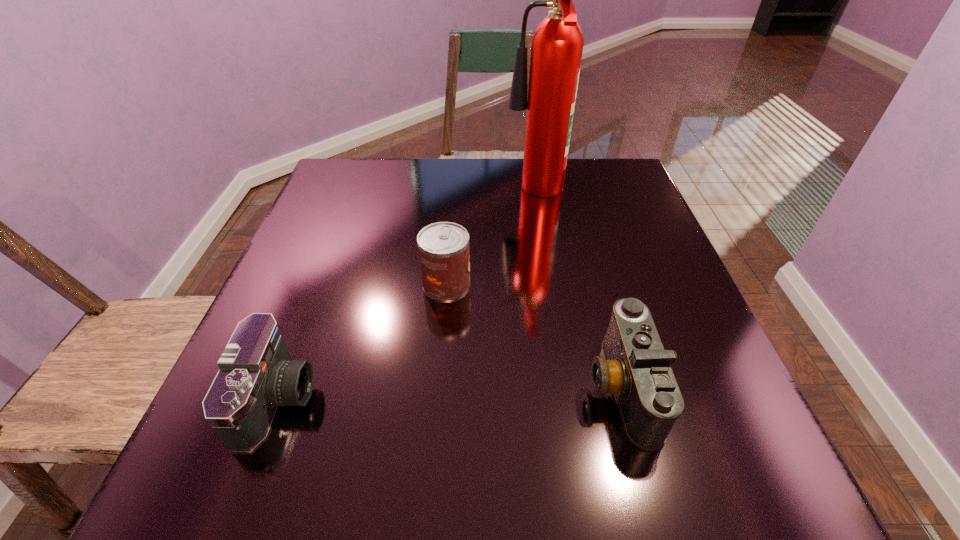
Identify the location of vacant area located on the lens of the right camera. Image resolution: width=960 pixels, height=540 pixels. (362, 386).

Image resolution: width=960 pixels, height=540 pixels. Find the location of `free spot located on the lens of the right camera`. free spot located on the lens of the right camera is located at coordinates (545, 386).

Image resolution: width=960 pixels, height=540 pixels. What are the coordinates of `vacant space located on the lens of the right camera` in the screenshot? It's located at (491, 386).

At what (x,y) coordinates should I click in order to perform the action: click on vacant space located on the front-facing side of the leftmost object. Please return your answer as a coordinate pair (x, y). Looking at the image, I should click on (557, 399).

At what (x,y) coordinates should I click in order to perform the action: click on object present at the far edge. Please return your answer as a coordinate pair (x, y). Looking at the image, I should click on (557, 44).

At what (x,y) coordinates should I click in order to perform the action: click on object situated at the left edge. Please return your answer as a coordinate pair (x, y). The width and height of the screenshot is (960, 540). Looking at the image, I should click on (256, 374).

Identify the location of object that is at the right edge. The width and height of the screenshot is (960, 540). (637, 369).

Where is `object that is at the near left corner`? object that is at the near left corner is located at coordinates (256, 374).

This screenshot has width=960, height=540. I want to click on object present at the near right corner, so click(x=637, y=369).

Locate an element on the screen. vacant space at the far edge of the desktop is located at coordinates (525, 194).